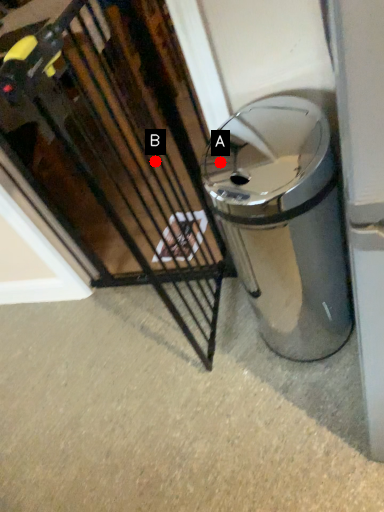
Question: Two points are circled on the image, labeled by A and B beside each circle. Which point is closer to the camera taking this photo?

Choices:
 (A) A is closer
 (B) B is closer

Answer: (A)